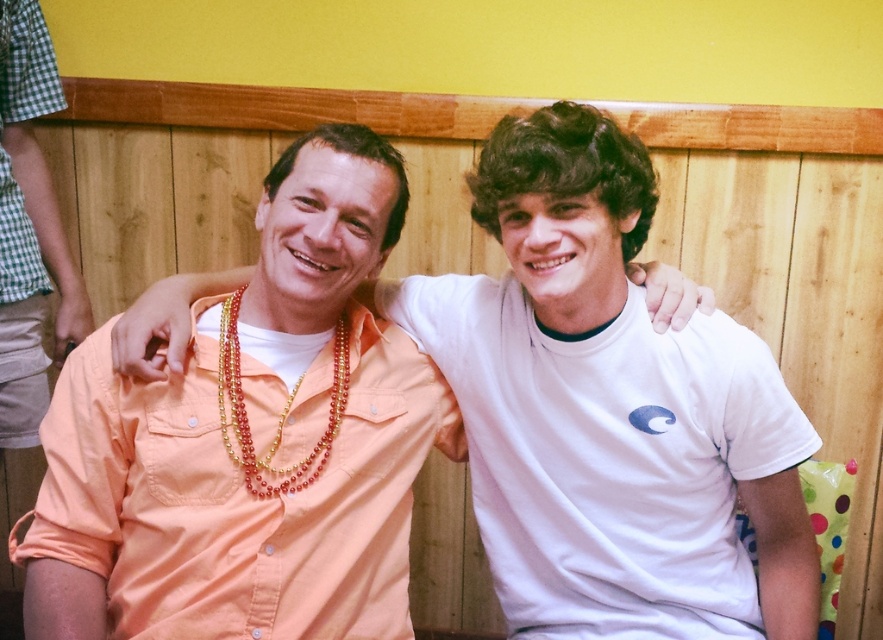
You are standing in front of the image and want to describe the position of the checkered fabric shorts at left relative to the wooden wall. Where exactly is it placed?

The checkered fabric shorts at left is located at point (20, 122) relative to the wooden wall.

You are a photographer preparing to take a group photo. You notice the checkered fabric shorts at left and the multicolored beaded necklace at center in the scene. Which item is narrower?

The checkered fabric shorts at left are narrower than the multicolored beaded necklace at center.